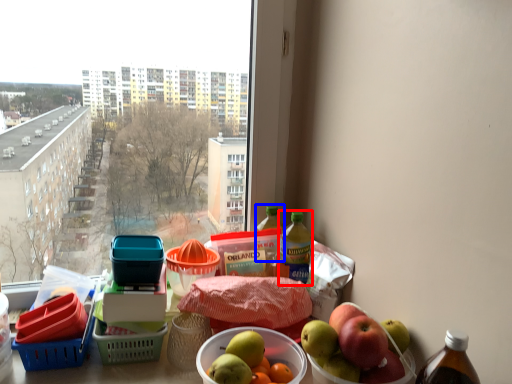
Question: Which of the following is the closest to the observer, bottle (highlighted by a red box) or bottle (highlighted by a blue box)?

Choices:
 (A) bottle
 (B) bottle

Answer: (A)